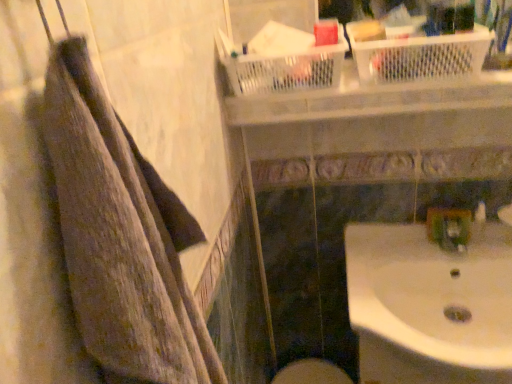
Question: From a real-world perspective, is white glossy sink at lower right physically located above or below brown textured towel at left?

Choices:
 (A) below
 (B) above

Answer: (A)

Question: Is point (450, 362) positioned closer to the camera than point (105, 120)?

Choices:
 (A) farther
 (B) closer

Answer: (A)

Question: Which object is the closest to the green plastic faucet at lower right?

Choices:
 (A) brown textured towel at left
 (B) white glossy sink at lower right

Answer: (B)

Question: Estimate the real-world distances between objects in this image. Which object is farther from the white glossy sink at lower right?

Choices:
 (A) green plastic faucet at lower right
 (B) brown textured towel at left

Answer: (B)